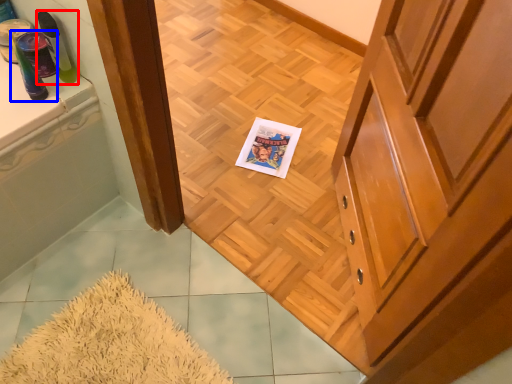
Question: Among these objects, which one is farthest to the camera, toiletry (highlighted by a red box) or toiletry (highlighted by a blue box)?

Choices:
 (A) toiletry
 (B) toiletry

Answer: (A)